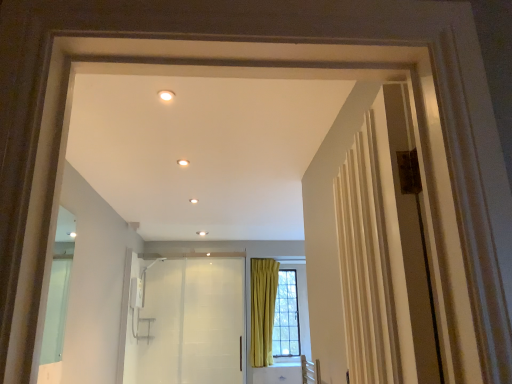
Question: Should I look upward or downward to see clear glass window at center?

Choices:
 (A) up
 (B) down

Answer: (B)

Question: From a real-world perspective, is clear glass window at center beneath white glossy elevator at center?

Choices:
 (A) yes
 (B) no

Answer: (B)

Question: From the image's perspective, does clear glass window at center appear higher than white glossy elevator at center?

Choices:
 (A) yes
 (B) no

Answer: (B)

Question: Is clear glass window at center far from white glossy elevator at center?

Choices:
 (A) no
 (B) yes

Answer: (B)

Question: From a real-world perspective, is clear glass window at center located higher than white glossy elevator at center?

Choices:
 (A) no
 (B) yes

Answer: (B)

Question: Is clear glass window at center looking in the opposite direction of white glossy elevator at center?

Choices:
 (A) no
 (B) yes

Answer: (A)

Question: Is clear glass window at center wider than white glossy elevator at center?

Choices:
 (A) no
 (B) yes

Answer: (B)

Question: Is white glossy elevator at center smaller than clear glass window at center?

Choices:
 (A) no
 (B) yes

Answer: (B)

Question: Does white glossy elevator at center have a larger size compared to clear glass window at center?

Choices:
 (A) no
 (B) yes

Answer: (A)

Question: Is white glossy elevator at center facing away from clear glass window at center?

Choices:
 (A) no
 (B) yes

Answer: (A)

Question: From a real-world perspective, is white glossy elevator at center on top of clear glass window at center?

Choices:
 (A) yes
 (B) no

Answer: (B)

Question: Can you confirm if white glossy elevator at center is positioned to the right of clear glass window at center?

Choices:
 (A) yes
 (B) no

Answer: (B)

Question: Is white glossy elevator at center positioned far away from clear glass window at center?

Choices:
 (A) yes
 (B) no

Answer: (A)

Question: Is white glossy elevator at center wider or thinner than clear glass window at center?

Choices:
 (A) thin
 (B) wide

Answer: (A)